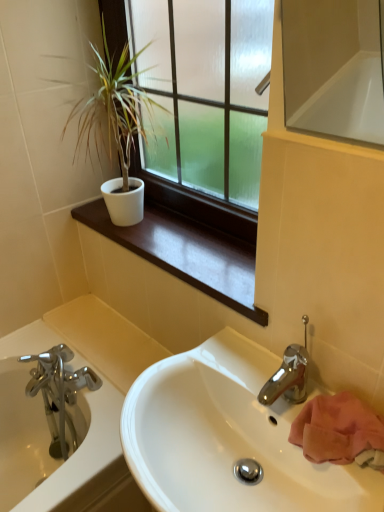
Locate an element on the screen. empty space that is ontop of white matte window sill at upper center (from a real-world perspective) is located at coordinates (180, 242).